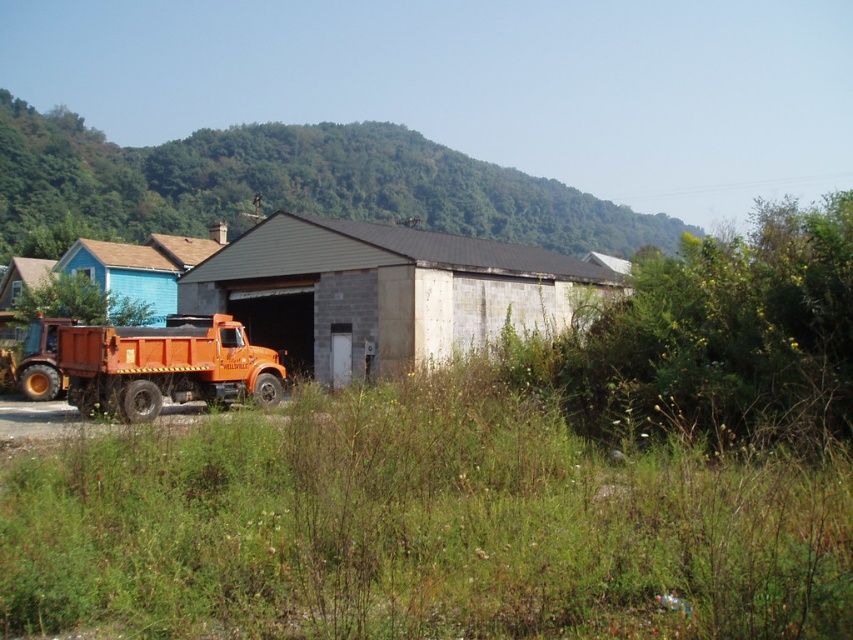
You are standing at the point marked by the coordinates point (283,186) in the image. What is the immediate terrain feature you are standing on?

The point (283,186) marks green leafy hillside at upper center, so you are standing on a green leafy hillside at upper center.

You are a landscape architect designing a new garden. You need to decide which area to prioritize based on the size of the green leafy hillside at upper center and the orange matte dump truck at left. Which object should you focus on first if you want to work on the larger area?

The green leafy hillside at upper center is larger in size than the orange matte dump truck at left, so you should focus on the green leafy hillside at upper center first.

You are a delivery driver who needs to park your truck in a spot that is taller than the green leafy hillside at upper center. Can you park your truck in the current location where the orange metallic truck at left is parked?

The orange metallic truck at left has a lesser height compared to the green leafy hillside at upper center, so if you park there, your truck will not meet the requirement of being taller than the green leafy hillside at upper center.